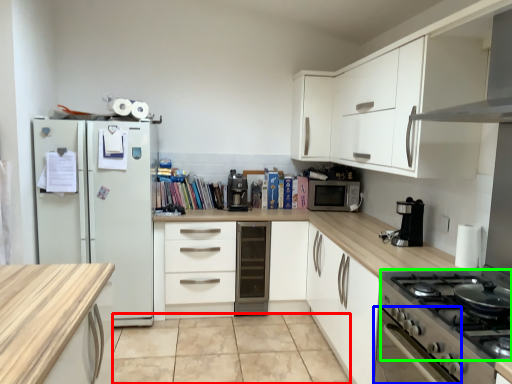
Question: Which object is the closest to the tile (highlighted by a red box)? Choose among these: oven (highlighted by a blue box) or gas stove (highlighted by a green box).

Choices:
 (A) oven
 (B) gas stove

Answer: (A)